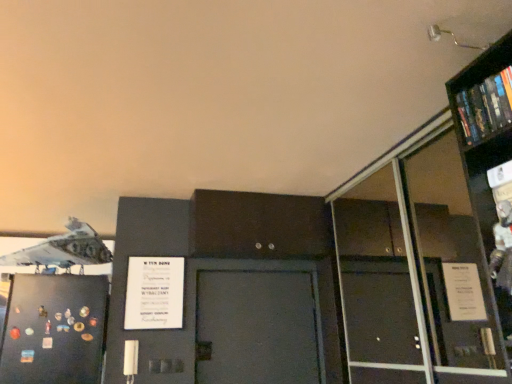
Where is `hardcover book at upper right`? hardcover book at upper right is located at coordinates (485, 106).

Measure the distance between hardcover book at upper right and camera.

hardcover book at upper right is 1.49 meters from camera.

Locate an element on the screen. The width and height of the screenshot is (512, 384). black matte refrigerator at left is located at coordinates (54, 329).

Image resolution: width=512 pixels, height=384 pixels. What are the coordinates of `white matte airplane at upper left` in the screenshot? It's located at (63, 250).

This screenshot has width=512, height=384. Find the location of `hardcover book at upper right`. hardcover book at upper right is located at coordinates (485, 106).

Considering the positions of objects white matte airplane at upper left and black matte refrigerator at left in the image provided, who is more to the left, white matte airplane at upper left or black matte refrigerator at left?

Positioned to the left is white matte airplane at upper left.

In terms of height, does white matte airplane at upper left look taller or shorter compared to black matte refrigerator at left?

Considering their sizes, white matte airplane at upper left has less height than black matte refrigerator at left.

Is white matte airplane at upper left not near black matte refrigerator at left?

They are positioned close to each other.

In the scene shown: Can black matte refrigerator at left be found inside white matte airplane at upper left?

No, black matte refrigerator at left is not surrounded by white matte airplane at upper left.

Find the location of a particular element. Image resolution: width=512 pixels, height=384 pixels. book that appears on the right of black matte refrigerator at left is located at coordinates (485, 106).

Does hardcover book at upper right lie in front of black matte refrigerator at left?

Yes, hardcover book at upper right is in front of black matte refrigerator at left.

Considering the relative positions of hardcover book at upper right and black matte refrigerator at left in the image provided, is hardcover book at upper right to the left of black matte refrigerator at left from the viewer's perspective?

In fact, hardcover book at upper right is to the right of black matte refrigerator at left.

Is hardcover book at upper right facing away from black matte refrigerator at left?

No.

Can you confirm if white paper poster at center is taller than white matte airplane at upper left?

Yes.

Is point (155, 306) closer to camera compared to point (81, 223)?

Yes, it is.

Can you tell me how much white paper poster at center and white matte airplane at upper left differ in facing direction?

91.5 degrees.

The width and height of the screenshot is (512, 384). In the image, there is a white matte airplane at upper left. Identify the location of poster below it (from the image's perspective). (154, 293).

Is point (471, 89) more distant than point (163, 275)?

No, (471, 89) is in front of (163, 275).

The width and height of the screenshot is (512, 384). What are the coordinates of `poster located underneath the hardcover book at upper right (from a real-world perspective)` in the screenshot? It's located at (154, 293).

Considering the sizes of objects hardcover book at upper right and white paper poster at center in the image provided, who is shorter, hardcover book at upper right or white paper poster at center?

Standing shorter between the two is hardcover book at upper right.

Is hardcover book at upper right thinner than white paper poster at center?

No.

Is white paper poster at center positioned with its back to transparent glass bookcase at upper right?

white paper poster at center does not have its back to transparent glass bookcase at upper right.

Is white paper poster at center further to camera compared to transparent glass bookcase at upper right?

Yes.

Do you think white paper poster at center is within transparent glass bookcase at upper right, or outside of it?

white paper poster at center exists outside the volume of transparent glass bookcase at upper right.

Is hardcover book at upper right at the right side of transparent glass bookcase at upper right?

Yes, hardcover book at upper right is to the right of transparent glass bookcase at upper right.

Which is behind, hardcover book at upper right or transparent glass bookcase at upper right?

transparent glass bookcase at upper right.

In the scene shown: Does hardcover book at upper right have a lesser height compared to transparent glass bookcase at upper right?

Indeed, hardcover book at upper right has a lesser height compared to transparent glass bookcase at upper right.

Consider the image. Considering the relative sizes of hardcover book at upper right and transparent glass bookcase at upper right in the image provided, is hardcover book at upper right bigger than transparent glass bookcase at upper right?

Actually, hardcover book at upper right might be smaller than transparent glass bookcase at upper right.

Is transparent glass bookcase at upper right next to white matte airplane at upper left?

transparent glass bookcase at upper right and white matte airplane at upper left are clearly separated.

Can you confirm if transparent glass bookcase at upper right is shorter than white matte airplane at upper left?

No, transparent glass bookcase at upper right is not shorter than white matte airplane at upper left.

From the picture: Considering the relative sizes of transparent glass bookcase at upper right and white matte airplane at upper left in the image provided, is transparent glass bookcase at upper right smaller than white matte airplane at upper left?

Indeed, transparent glass bookcase at upper right has a smaller size compared to white matte airplane at upper left.

The width and height of the screenshot is (512, 384). In order to click on airplane above the black matte refrigerator at left (from a real-world perspective) in this screenshot , I will do `click(63, 250)`.

Locate an element on the screen. Image resolution: width=512 pixels, height=384 pixels. door behind the hardcover book at upper right is located at coordinates coord(54,329).

Looking at the image, which one is located closer to white matte airplane at upper left, white paper poster at center or hardcover book at upper right?

Based on the image, white paper poster at center appears to be nearer to white matte airplane at upper left.

When comparing their distances from hardcover book at upper right, does black matte refrigerator at left or white matte airplane at upper left seem further?

Among the two, black matte refrigerator at left is located further to hardcover book at upper right.

Based on their spatial positions, is white paper poster at center or hardcover book at upper right further from black matte refrigerator at left?

Based on the image, hardcover book at upper right appears to be further to black matte refrigerator at left.

Based on their spatial positions, is white paper poster at center or transparent glass bookcase at upper right closer to black matte refrigerator at left?

white paper poster at center is closer to black matte refrigerator at left.

Considering their positions, is black matte refrigerator at left positioned further to transparent glass bookcase at upper right than white paper poster at center?

Based on the image, black matte refrigerator at left appears to be further to transparent glass bookcase at upper right.

Estimate the real-world distances between objects in this image. Which object is closer to black matte refrigerator at left, hardcover book at upper right or white paper poster at center?

white paper poster at center is closer to black matte refrigerator at left.

Considering their positions, is hardcover book at upper right positioned further to white matte airplane at upper left than white paper poster at center?

Among the two, hardcover book at upper right is located further to white matte airplane at upper left.

Based on their spatial positions, is white matte airplane at upper left or black matte refrigerator at left closer to white paper poster at center?

The object closer to white paper poster at center is black matte refrigerator at left.

Locate an element on the screen. bookcase located between white matte airplane at upper left and hardcover book at upper right in the left-right direction is located at coordinates (429, 249).

Where is `poster located between white matte airplane at upper left and hardcover book at upper right in the left-right direction`? The width and height of the screenshot is (512, 384). poster located between white matte airplane at upper left and hardcover book at upper right in the left-right direction is located at coordinates (154, 293).

Where is `door between white matte airplane at upper left and transparent glass bookcase at upper right`? This screenshot has height=384, width=512. door between white matte airplane at upper left and transparent glass bookcase at upper right is located at coordinates (54, 329).

Where is `poster between white matte airplane at upper left and transparent glass bookcase at upper right in the horizontal direction`? Image resolution: width=512 pixels, height=384 pixels. poster between white matte airplane at upper left and transparent glass bookcase at upper right in the horizontal direction is located at coordinates (154, 293).